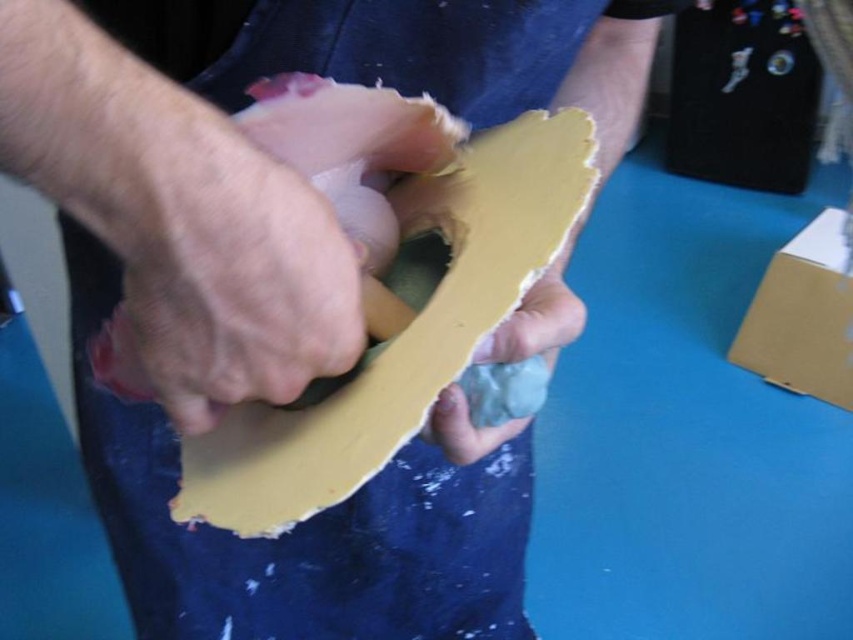
From the picture: Can you confirm if matte yellow sandpaper at center is thinner than matte yellow paper at center?

Incorrect, matte yellow sandpaper at center's width is not less than matte yellow paper at center's.

From the picture: Who is more forward, (128, 346) or (547, 330)?

Point (128, 346) is in front.

Where is `matte yellow sandpaper at center`? The height and width of the screenshot is (640, 853). matte yellow sandpaper at center is located at coordinates (120, 362).

Between point (799, 385) and point (169, 291), which one is positioned in front?

Positioned in front is point (169, 291).

In order to click on matte cardboard box at lower right in this screenshot , I will do `click(802, 316)`.

Is point (836, 298) positioned in front of point (244, 360)?

No, (836, 298) is further to viewer.

You are a GUI agent. You are given a task and a screenshot of the screen. Output one action in this format:
    pyautogui.click(x=<x>, y=<y>)
    Task: Click on the matte cardboard box at lower right
    This screenshot has width=853, height=640.
    Given the screenshot: What is the action you would take?
    pyautogui.click(x=802, y=316)

Which is above, matte cardboard box at lower right or matte yellow paper at center?

matte cardboard box at lower right is above.

Which is more to the right, matte cardboard box at lower right or matte yellow paper at center?

matte cardboard box at lower right

Who is more distant from viewer, (844, 323) or (544, 349)?

Point (844, 323)

The width and height of the screenshot is (853, 640). In order to click on matte cardboard box at lower right in this screenshot , I will do `click(802, 316)`.